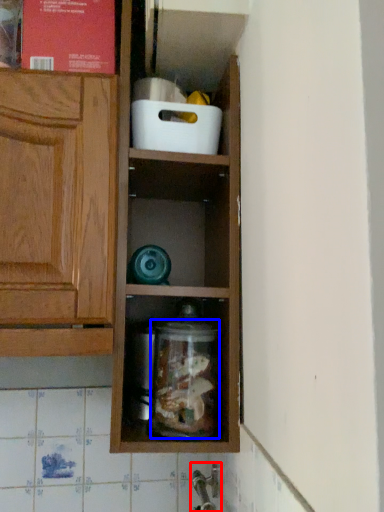
Question: Which point is further to the camera, faucet (highlighted by a red box) or glass jar (highlighted by a blue box)?

Choices:
 (A) faucet
 (B) glass jar

Answer: (A)